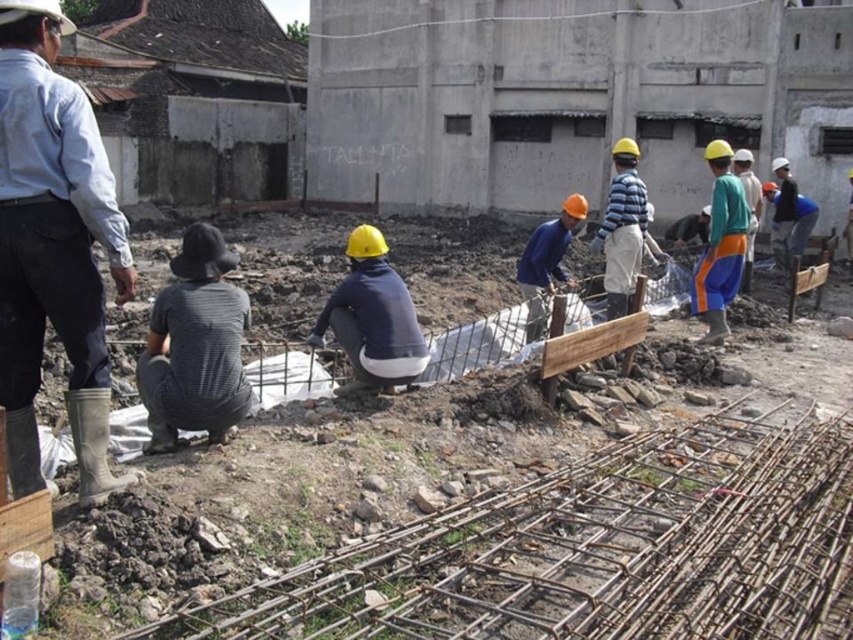
Question: Can you confirm if green fabric pants at right is thinner than orange fabric pants at center?

Choices:
 (A) no
 (B) yes

Answer: (A)

Question: Is green fabric pants at right to the left of blue matte shirt at center from the viewer's perspective?

Choices:
 (A) no
 (B) yes

Answer: (A)

Question: Which of the following is the farthest from the observer?

Choices:
 (A) (370, 266)
 (B) (213, 304)

Answer: (A)

Question: Which of these objects is positioned closest to the light blue shirt at upper left?

Choices:
 (A) blue matte shirt at center
 (B) dark gray cotton shirt at lower left
 (C) matte blue shirt at center

Answer: (B)

Question: Where is light blue shirt at upper left located in relation to green fabric pants at right in the image?

Choices:
 (A) below
 (B) above

Answer: (A)

Question: Estimate the real-world distances between objects in this image. Which object is closer to the matte blue shirt at center?

Choices:
 (A) green fabric pants at right
 (B) orange fabric pants at center
 (C) dark gray cotton shirt at lower left

Answer: (C)